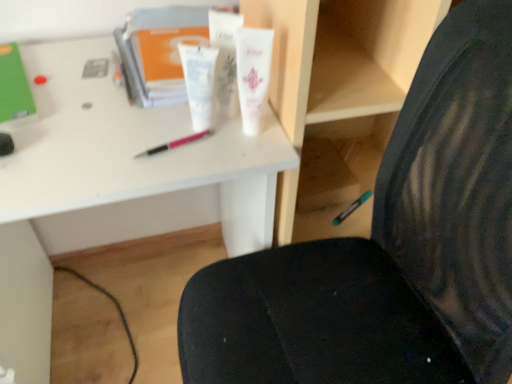
Locate an element on the screen. free space that is in between white plastic book at upper center and green matte folder at upper left, positioned as the first stationery in front-to-back order is located at coordinates (71, 76).